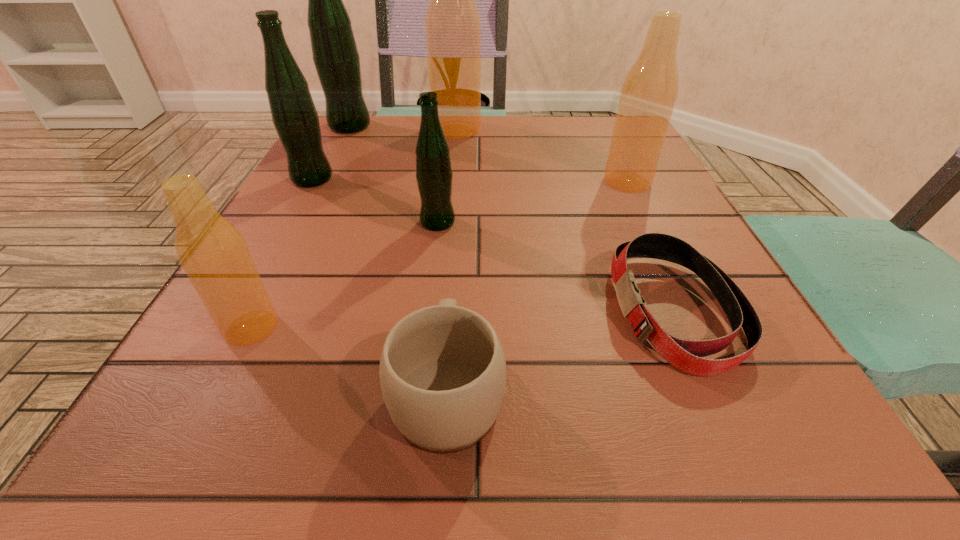
Identify the location of the second shortest object. (442, 371).

This screenshot has height=540, width=960. In order to click on dog collar in this screenshot , I will do `click(685, 355)`.

Image resolution: width=960 pixels, height=540 pixels. I want to click on pink dog collar, so click(x=685, y=355).

The height and width of the screenshot is (540, 960). What are the coordinates of `free space located on the front of the biggest green beer bottle` in the screenshot? It's located at (322, 180).

You are a GUI agent. You are given a task and a screenshot of the screen. Output one action in this format:
    pyautogui.click(x=<x>, y=<y>)
    Task: Click on the free point located on the right of the biggest tan beer bottle
    Image resolution: width=960 pixels, height=540 pixels.
    Given the screenshot: What is the action you would take?
    pyautogui.click(x=629, y=130)

Locate an element on the screen. The image size is (960, 540). vacant space located on the left of the second farthest tan beer bottle is located at coordinates (515, 182).

The height and width of the screenshot is (540, 960). In order to click on vacant point located 0.080m on the back of the second farthest green beer bottle in this screenshot , I will do `click(327, 151)`.

Where is `free spot located on the back of the fifth farthest beer bottle`? The height and width of the screenshot is (540, 960). free spot located on the back of the fifth farthest beer bottle is located at coordinates (448, 135).

Where is `free space located 0.200m on the right of the nearest tan beer bottle`? Image resolution: width=960 pixels, height=540 pixels. free space located 0.200m on the right of the nearest tan beer bottle is located at coordinates (424, 328).

Where is `free space located 0.310m on the side of the second shortest object with the handle`? The image size is (960, 540). free space located 0.310m on the side of the second shortest object with the handle is located at coordinates (459, 207).